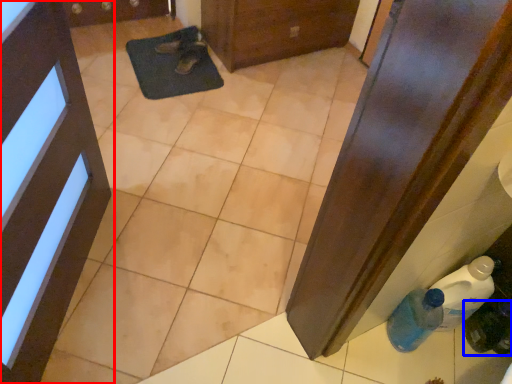
Question: Which of the following is the closest to the observer, door (highlighted by a red box) or bottle (highlighted by a blue box)?

Choices:
 (A) door
 (B) bottle

Answer: (A)